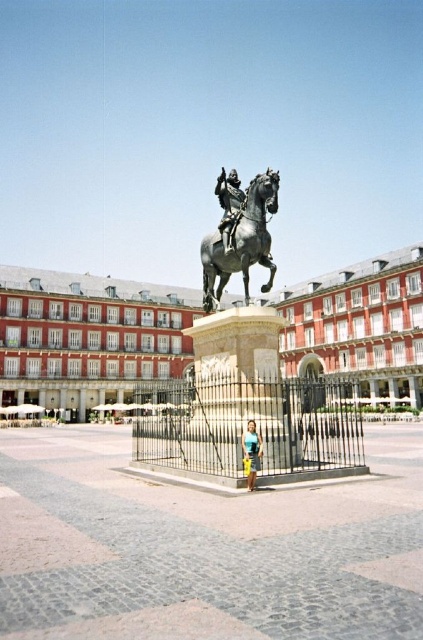
Is red brick building at center positioned behind blue denim shorts at center?

Yes, it is behind blue denim shorts at center.

Between red brick building at center and blue denim shorts at center, which one has more height?

red brick building at center is taller.

Who is more forward, (340, 340) or (253, 483)?

Positioned in front is point (253, 483).

The height and width of the screenshot is (640, 423). Identify the location of red brick building at center. (87, 336).

Is polished bronze statue at center above blue denim shorts at center?

Result: Yes.

Is point (236, 198) farther from camera compared to point (249, 488)?

That is True.

This screenshot has width=423, height=640. Identify the location of polished bronze statue at center. (228, 205).

Is bronze/golden horse at center positioned behind polished bronze statue at center?

No, bronze/golden horse at center is in front of polished bronze statue at center.

Which is more to the right, bronze/golden horse at center or polished bronze statue at center?

bronze/golden horse at center is more to the right.

Is point (263, 246) positioned before point (220, 172)?

Yes, it is in front of point (220, 172).

The height and width of the screenshot is (640, 423). Find the location of `bronze/golden horse at center`. bronze/golden horse at center is located at coordinates (241, 241).